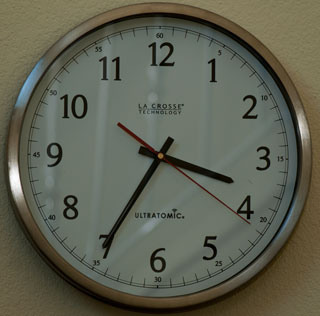
Image resolution: width=320 pixels, height=316 pixels. Identify the location of wall. (286, 279).